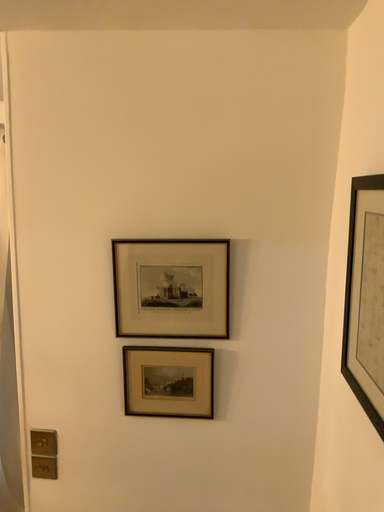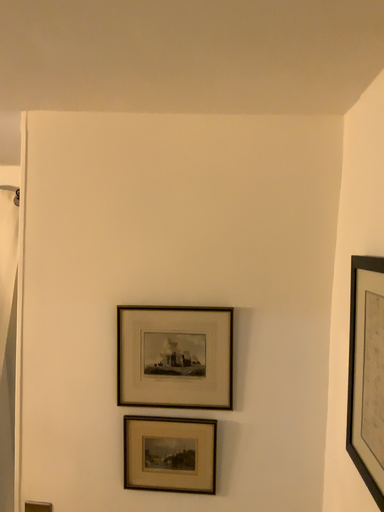
Question: Which way did the camera rotate in the video?

Choices:
 (A) rotated downward
 (B) rotated upward

Answer: (B)